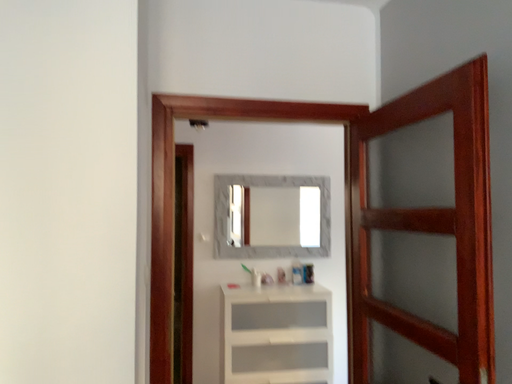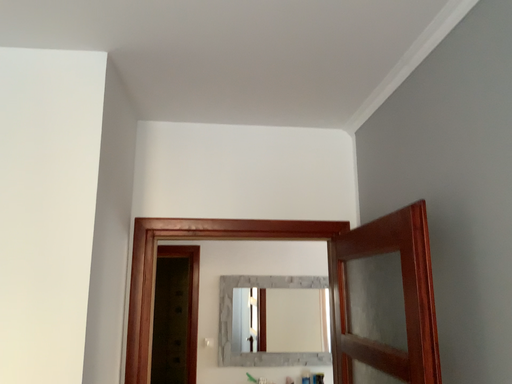
Question: How did the camera likely rotate when shooting the video?

Choices:
 (A) rotated upward
 (B) rotated downward

Answer: (A)